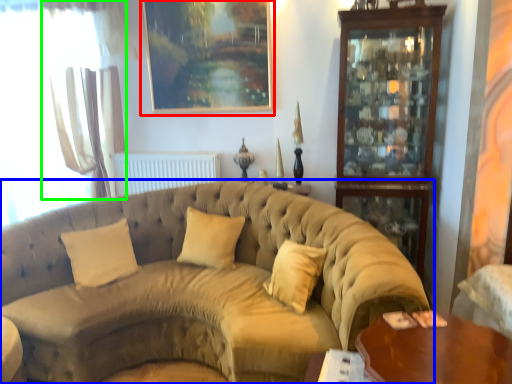
Question: Which is nearer to the picture frame (highlighted by a red box)? studio couch (highlighted by a blue box) or curtain (highlighted by a green box).

Choices:
 (A) studio couch
 (B) curtain

Answer: (B)